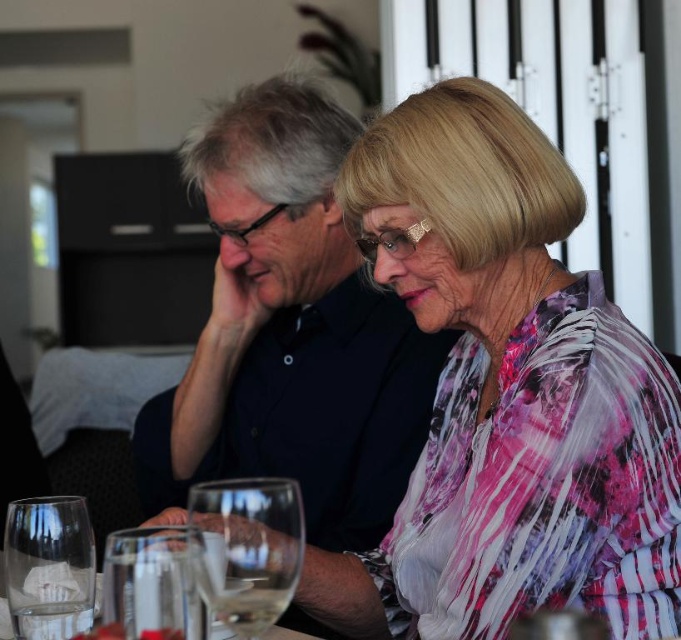
Question: Does dark blue shirt at center appear on the left side of clear glass wine glass at lower left?

Choices:
 (A) yes
 (B) no

Answer: (A)

Question: Does dark blue shirt at center have a smaller size compared to transparent glass at lower left?

Choices:
 (A) yes
 (B) no

Answer: (B)

Question: Among these points, which one is farthest from the camera?

Choices:
 (A) (296, 92)
 (B) (262, 589)
 (C) (506, 236)
 (D) (168, 531)

Answer: (A)

Question: Is pink floral blouse at center in front of transparent glass at lower left?

Choices:
 (A) no
 (B) yes

Answer: (A)

Question: Which point appears farthest from the camera in this image?

Choices:
 (A) (195, 596)
 (B) (229, 515)
 (C) (464, 340)

Answer: (C)

Question: Among these objects, which one is farthest from the camera?

Choices:
 (A) clear glass wine glass at lower left
 (B) dark blue shirt at center
 (C) pink floral blouse at center

Answer: (B)